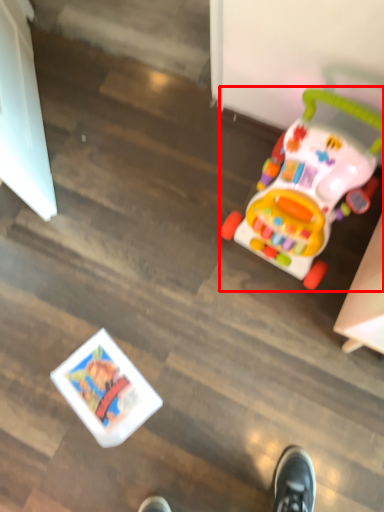
Question: Where is toy (annotated by the red box) located in relation to toy in the image?

Choices:
 (A) right
 (B) left

Answer: (A)